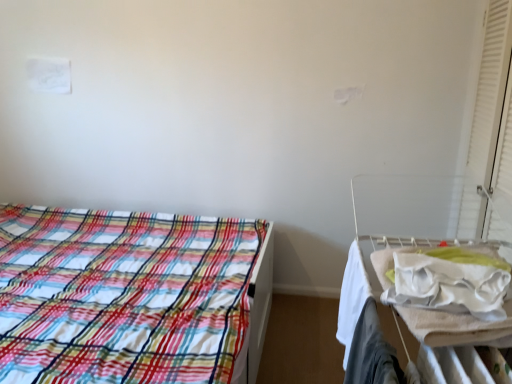
Question: Would you say plaid fabric bed at left is to the left or to the right of white fabric at right in the picture?

Choices:
 (A) right
 (B) left

Answer: (B)

Question: Considering the positions of plaid fabric bed at left and white fabric at right in the image, is plaid fabric bed at left bigger or smaller than white fabric at right?

Choices:
 (A) small
 (B) big

Answer: (B)

Question: Estimate the real-world distances between objects in this image. Which object is closer to the plaid fabric bed at left?

Choices:
 (A) white fabric at right
 (B) white matte curtain at right
 (C) white fabric hospital bed at right

Answer: (C)

Question: Which object is the farthest from the white fabric hospital bed at right?

Choices:
 (A) plaid fabric bed at left
 (B) white matte curtain at right
 (C) white fabric at right

Answer: (A)